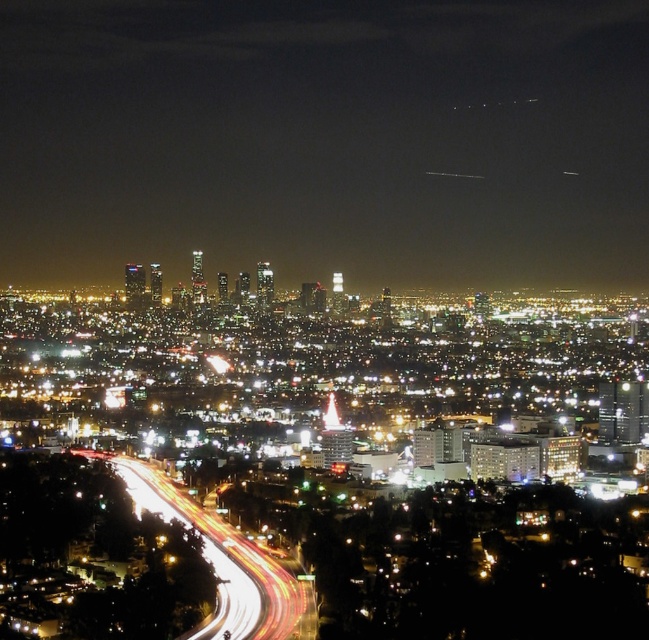
You are a drone operator planning to fly a drone with a 1000 feet operational range from your current position. If you want to capture the glittering glass skyscrapers at center in your footage, will your drone be able to reach them?

The distance between the glittering glass skyscrapers at center and the camera is 2097.14 feet. Since the drone has a 1000 feet operational range, it cannot reach the skyscrapers as the required distance exceeds its capability.

You are standing in the city at night and want to take a photo of both the glittering glass skyscrapers at center and the white light trails at lower left. Which object should you focus on first to ensure both are in the frame?

You should focus on the glittering glass skyscrapers at center first because it is closer to you than the white light trails at lower left, so adjusting the camera to include both will require starting with the closer object.

You are a drone operator planning to fly a drone from the curving roadway in the foreground to the glittering glass skyscrapers at center. According to the coordinates provided, what are the x and y coordinates you should aim for?

The glittering glass skyscrapers at center are located at coordinates x 0.220 and y 0.504, so you should aim for those coordinates.